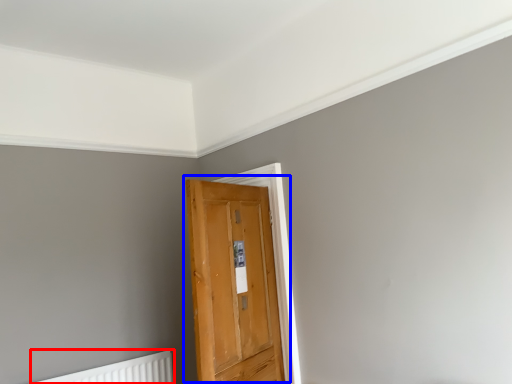
Question: Among these objects, which one is farthest to the camera, radiator (highlighted by a red box) or door (highlighted by a blue box)?

Choices:
 (A) radiator
 (B) door

Answer: (A)